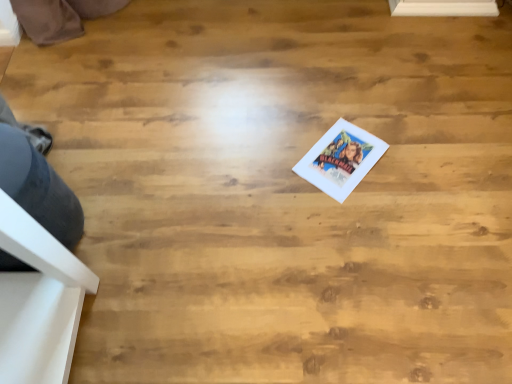
Question: Is matte paper postcard at center taller or shorter than gray fabric shoe at lower left?

Choices:
 (A) tall
 (B) short

Answer: (B)

Question: From the image's perspective, is matte paper postcard at center positioned above or below gray fabric shoe at lower left?

Choices:
 (A) below
 (B) above

Answer: (B)

Question: Looking at their shapes, would you say matte paper postcard at center is wider or thinner than gray fabric shoe at lower left?

Choices:
 (A) thin
 (B) wide

Answer: (A)

Question: From the image's perspective, is gray fabric shoe at lower left located above or below matte paper postcard at center?

Choices:
 (A) above
 (B) below

Answer: (B)

Question: Based on their sizes in the image, would you say gray fabric shoe at lower left is bigger or smaller than matte paper postcard at center?

Choices:
 (A) big
 (B) small

Answer: (A)

Question: Looking at their shapes, would you say gray fabric shoe at lower left is wider or thinner than matte paper postcard at center?

Choices:
 (A) thin
 (B) wide

Answer: (B)

Question: Is gray fabric shoe at lower left to the left or to the right of matte paper postcard at center in the image?

Choices:
 (A) right
 (B) left

Answer: (B)